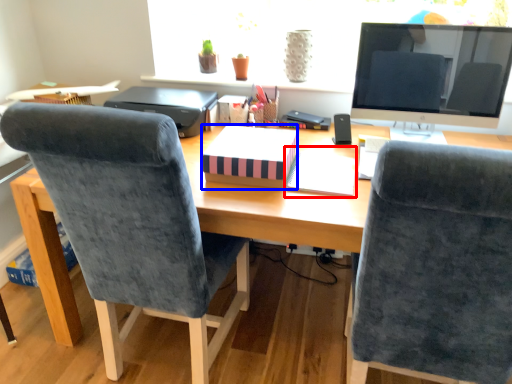
Question: Among these objects, which one is farthest to the camera, notebook (highlighted by a red box) or notebook (highlighted by a blue box)?

Choices:
 (A) notebook
 (B) notebook

Answer: (A)